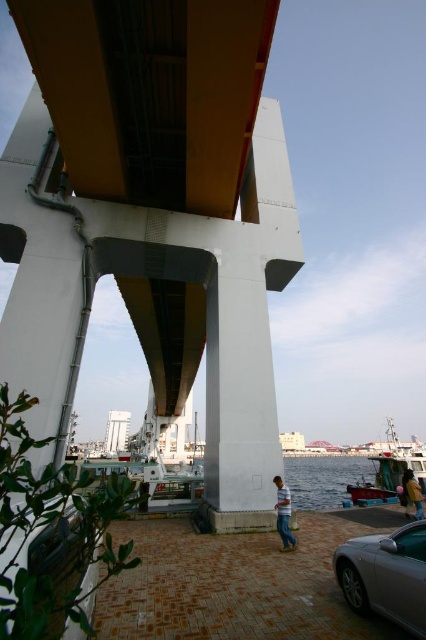
You are standing on the paved path under the bridge and want to take a photo of the white smooth concrete pillar at center and the silver metallic car at lower right. To include both in your shot, should you adjust your camera to the left or right side?

The white smooth concrete pillar at center is positioned on the left side of silver metallic car at lower right, so you should adjust your camera to the left to capture both in the frame.

In the scene shown: You are a photographer trying to capture the bridge structure. You notice the white smooth concrete pillar at center and the silver metallic car at lower right. Which object should you focus on if you want to highlight something taller in your photo?

The white smooth concrete pillar at center is taller than the silver metallic car at lower right, so focusing on it would highlight the taller object in your photo.

You are standing directly below the large modern bridge and want to find the white smooth concrete pillar at center. According to the coordinates provided, where should you look relative to your current position?

The white smooth concrete pillar at center is located at coordinates point (x=238, y=401), which means it is positioned to the right and slightly above your current viewpoint when standing directly below the bridge.